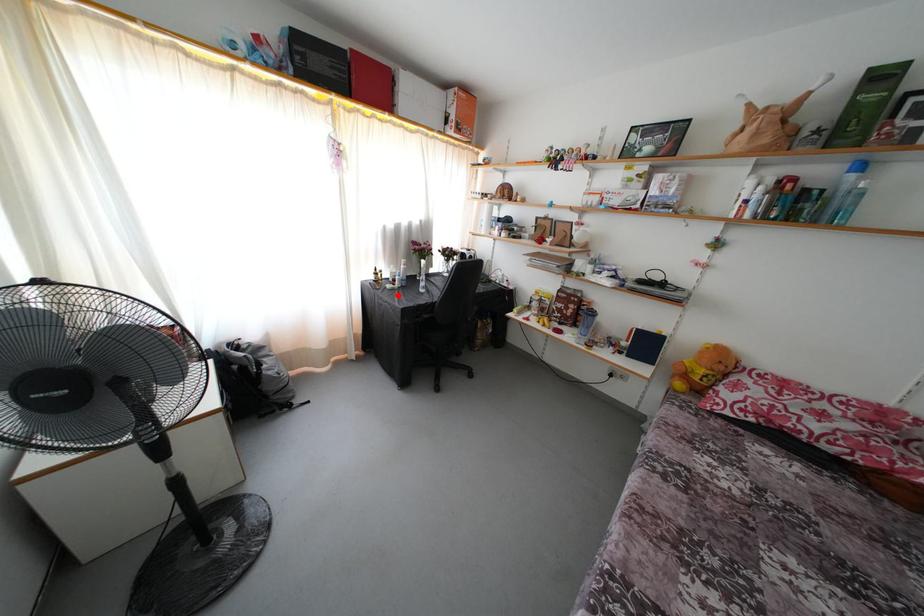
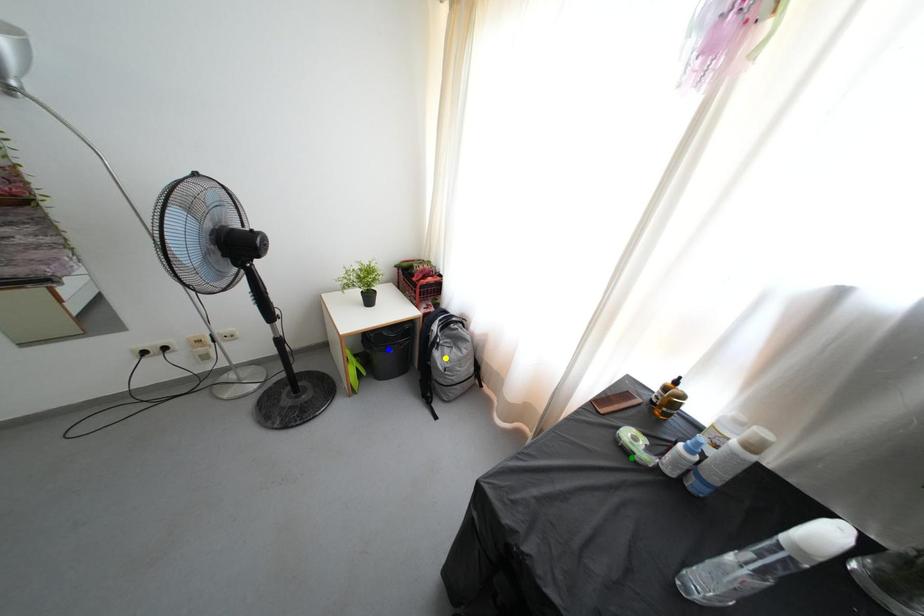
Question: I am providing you with two images of the same scene from different viewpoints. A red point is marked on the first image. You are given multiple points on the second image. Which point in image 2 is actually the same real-world point as the red point in image 1?

Choices:
 (A) yellow point
 (B) green point
 (C) blue point

Answer: (B)